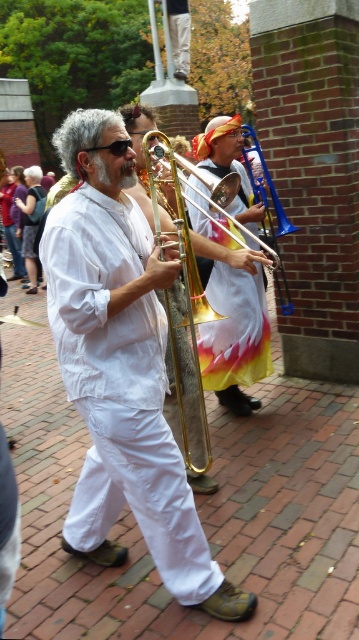
You are standing at the center of the street and want to move towards the white linen robe at center. Which direction should you move to reach it?

Since the white linen robe at center is located at point 0.609 on the x axis and 0.334 on the y axis, you should move forward and slightly to the right to reach it.

You are a photographer trying to capture the central musician in the scene. You want to ensure both the white linen robe at center and the gold brass trombone at center are clearly visible in your shot. Which object should you focus on first to ensure it fits within the frame?

The white linen robe at center is bigger than the gold brass trombone at center, so you should focus on capturing the white linen robe at center first to ensure it fits within the frame, as it requires more space.